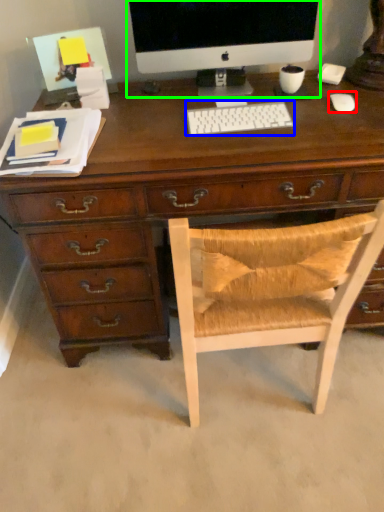
Question: Which is nearer to the mouse (highlighted by a red box)? computer keyboard (highlighted by a blue box) or computer monitor (highlighted by a green box).

Choices:
 (A) computer keyboard
 (B) computer monitor

Answer: (A)